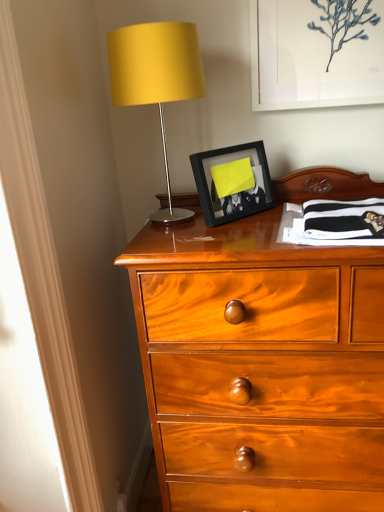
Question: From a real-world perspective, is white matte picture frame at upper center, acting as the 1th picture frame starting from the right, positioned above or below black matte picture frame at center, which is counted as the 2th picture frame, starting from the right?

Choices:
 (A) above
 (B) below

Answer: (A)

Question: Looking at their shapes, would you say white matte picture frame at upper center, the first picture frame viewed from the top, is wider or thinner than black matte picture frame at center, which is the 2th picture frame in top-to-bottom order?

Choices:
 (A) wide
 (B) thin

Answer: (B)

Question: Based on their relative distances, which object is nearer to the white matte picture frame at upper center, which is the second picture frame from left to right?

Choices:
 (A) matte yellow fabric at upper left
 (B) black matte picture frame at center, positioned as the 1th picture frame in bottom-to-top order

Answer: (B)

Question: Which object is the farthest from the white matte picture frame at upper center, the first picture frame viewed from the top?

Choices:
 (A) matte yellow fabric at upper left
 (B) black matte picture frame at center, which is counted as the 2th picture frame, starting from the right

Answer: (A)